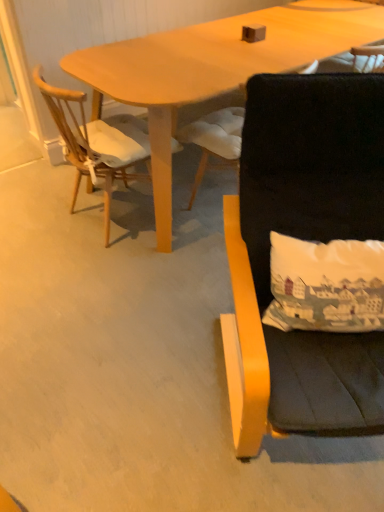
The height and width of the screenshot is (512, 384). What do you see at coordinates (214, 140) in the screenshot? I see `black fabric chair at center, which ranks as the 2th chair in left-to-right order` at bounding box center [214, 140].

In order to face wooden chair at left, marked as the 1th chair in a left-to-right arrangement, should I rotate leftwards or rightwards?

To align with it, rotate left about 10.692°.

The image size is (384, 512). I want to click on black fabric chair at right, which ranks as the 3th chair in left-to-right order, so tap(308, 240).

From a real-world perspective, is wooden chair at left, which is counted as the third chair, starting from the right, below black fabric chair at right, which ranks as the first chair in right-to-left order?

Yes, from a real-world perspective, wooden chair at left, which is counted as the third chair, starting from the right, is below black fabric chair at right, which ranks as the first chair in right-to-left order.

Locate an element on the screen. This screenshot has width=384, height=512. chair located above the wooden chair at left, marked as the 1th chair in a left-to-right arrangement (from a real-world perspective) is located at coordinates (308, 240).

Who is smaller, wooden chair at left, marked as the 1th chair in a left-to-right arrangement, or black fabric chair at right, which ranks as the first chair in right-to-left order?

Smaller between the two is wooden chair at left, marked as the 1th chair in a left-to-right arrangement.

Between wooden chair at left, marked as the 1th chair in a left-to-right arrangement, and black fabric chair at right, which ranks as the 3th chair in left-to-right order, which one appears on the right side from the viewer's perspective?

black fabric chair at right, which ranks as the 3th chair in left-to-right order, is more to the right.

Choose the correct answer: Is wooden chair at left, marked as the 1th chair in a left-to-right arrangement, inside black fabric chair at center, which ranks as the 2th chair in left-to-right order, or outside it?

wooden chair at left, marked as the 1th chair in a left-to-right arrangement, lies outside black fabric chair at center, which ranks as the 2th chair in left-to-right order.

Looking at this image, between wooden chair at left, marked as the 1th chair in a left-to-right arrangement, and black fabric chair at center, which ranks as the 2th chair in left-to-right order, which one has smaller width?

black fabric chair at center, which ranks as the 2th chair in left-to-right order.

Looking at this image, from the image's perspective, is wooden chair at left, which is counted as the third chair, starting from the right, under black fabric chair at center, which ranks as the 2th chair in left-to-right order?

Yes, from the image's perspective, wooden chair at left, which is counted as the third chair, starting from the right, is below black fabric chair at center, which ranks as the 2th chair in left-to-right order.

Does black fabric chair at center, which ranks as the 2th chair in left-to-right order, have a greater width compared to black fabric chair at right, which ranks as the first chair in right-to-left order?

Incorrect, the width of black fabric chair at center, which ranks as the 2th chair in left-to-right order, does not surpass that of black fabric chair at right, which ranks as the first chair in right-to-left order.

Does black fabric chair at center, which ranks as the 2th chair in left-to-right order, have a lesser height compared to black fabric chair at right, which ranks as the first chair in right-to-left order?

Correct, black fabric chair at center, which ranks as the 2th chair in left-to-right order, is not as tall as black fabric chair at right, which ranks as the first chair in right-to-left order.

Is point (205, 150) positioned after point (315, 150)?

Yes, it is behind point (315, 150).

Can you confirm if black fabric chair at right, which ranks as the 3th chair in left-to-right order, is thinner than black fabric chair at center, which is the second chair in right-to-left order?

No.

Which point is more distant from viewer, (365, 149) or (191, 123)?

Positioned behind is point (191, 123).

How many degrees apart are the facing directions of black fabric chair at right, which ranks as the first chair in right-to-left order, and black fabric chair at center, which is the second chair in right-to-left order?

144 degrees.

Is black fabric chair at center, which ranks as the 2th chair in left-to-right order, completely or partially inside black fabric chair at right, which ranks as the first chair in right-to-left order?

No, black fabric chair at right, which ranks as the first chair in right-to-left order, does not contain black fabric chair at center, which ranks as the 2th chair in left-to-right order.

Is black fabric chair at right, which ranks as the 3th chair in left-to-right order, wider than wooden chair at left, marked as the 1th chair in a left-to-right arrangement?

Yes.

Based on the photo, can you tell me how much black fabric chair at right, which ranks as the 3th chair in left-to-right order, and wooden chair at left, which is counted as the third chair, starting from the right, differ in facing direction?

black fabric chair at right, which ranks as the 3th chair in left-to-right order, and wooden chair at left, which is counted as the third chair, starting from the right, are facing 126 degrees away from each other.

The image size is (384, 512). Identify the location of chair that appears above the wooden chair at left, which is counted as the third chair, starting from the right (from a real-world perspective). pos(308,240).

Considering the points (214, 119) and (113, 174), which point is in front, point (214, 119) or point (113, 174)?

Positioned in front is point (113, 174).

Is black fabric chair at center, which is the second chair in right-to-left order, not close to wooden chair at left, which is counted as the third chair, starting from the right?

black fabric chair at center, which is the second chair in right-to-left order, is actually quite close to wooden chair at left, which is counted as the third chair, starting from the right.

Could you tell me if black fabric chair at center, which is the second chair in right-to-left order, is turned towards wooden chair at left, which is counted as the third chair, starting from the right?

No, black fabric chair at center, which is the second chair in right-to-left order, does not turn towards wooden chair at left, which is counted as the third chair, starting from the right.

Is black fabric chair at center, which is the second chair in right-to-left order, in front of or behind wooden chair at left, marked as the 1th chair in a left-to-right arrangement, in the image?

Clearly, black fabric chair at center, which is the second chair in right-to-left order, is behind wooden chair at left, marked as the 1th chair in a left-to-right arrangement.

The height and width of the screenshot is (512, 384). What are the coordinates of `chair in front of the wooden chair at left, which is counted as the third chair, starting from the right` in the screenshot? It's located at (308, 240).

From a real-world perspective, which chair is the 1st one above the black fabric chair at center, which is the second chair in right-to-left order? Please provide its 2D coordinates.

[(97, 143)]

From the image, which object appears to be farther from wooden chair at left, which is counted as the third chair, starting from the right, black fabric chair at right, which ranks as the 3th chair in left-to-right order, or black fabric chair at center, which is the second chair in right-to-left order?

black fabric chair at right, which ranks as the 3th chair in left-to-right order, is further to wooden chair at left, which is counted as the third chair, starting from the right.

Based on their spatial positions, is black fabric chair at center, which ranks as the 2th chair in left-to-right order, or wooden chair at left, which is counted as the third chair, starting from the right, further from black fabric chair at right, which ranks as the 3th chair in left-to-right order?

Among the two, wooden chair at left, which is counted as the third chair, starting from the right, is located further to black fabric chair at right, which ranks as the 3th chair in left-to-right order.

From the picture: Looking at the image, which one is located further to black fabric chair at right, which ranks as the first chair in right-to-left order, wooden chair at left, marked as the 1th chair in a left-to-right arrangement, or black fabric chair at center, which ranks as the 2th chair in left-to-right order?

wooden chair at left, marked as the 1th chair in a left-to-right arrangement, lies further to black fabric chair at right, which ranks as the first chair in right-to-left order, than the other object.

Considering their positions, is wooden chair at left, marked as the 1th chair in a left-to-right arrangement, positioned closer to black fabric chair at center, which ranks as the 2th chair in left-to-right order, than black fabric chair at right, which ranks as the 3th chair in left-to-right order?

wooden chair at left, marked as the 1th chair in a left-to-right arrangement, is closer to black fabric chair at center, which ranks as the 2th chair in left-to-right order.

Which object lies nearer to the anchor point black fabric chair at center, which is the second chair in right-to-left order, black fabric chair at right, which ranks as the 3th chair in left-to-right order, or wooden chair at left, which is counted as the third chair, starting from the right?

Among the two, wooden chair at left, which is counted as the third chair, starting from the right, is located nearer to black fabric chair at center, which is the second chair in right-to-left order.

Estimate the real-world distances between objects in this image. Which object is closer to wooden chair at left, marked as the 1th chair in a left-to-right arrangement, black fabric chair at center, which is the second chair in right-to-left order, or black fabric chair at right, which ranks as the first chair in right-to-left order?

black fabric chair at center, which is the second chair in right-to-left order, is closer to wooden chair at left, marked as the 1th chair in a left-to-right arrangement.

Find the location of a particular element. This screenshot has width=384, height=512. chair positioned between black fabric chair at right, which ranks as the first chair in right-to-left order, and black fabric chair at center, which ranks as the 2th chair in left-to-right order, from near to far is located at coordinates (97, 143).